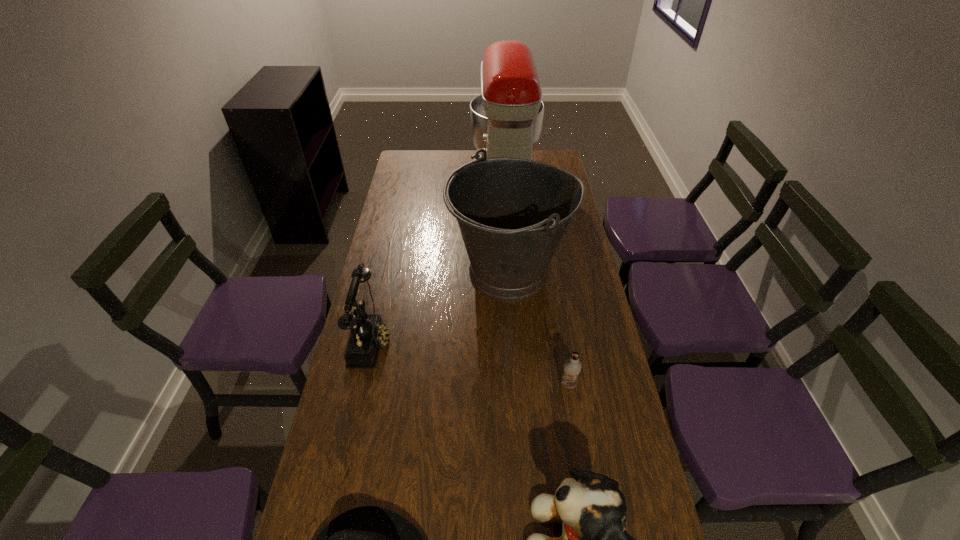
Find the location of a particular element. Image resolution: width=960 pixels, height=540 pixels. the tallest object is located at coordinates (506, 120).

Identify the location of mixer. This screenshot has height=540, width=960. (506, 120).

You are a GUI agent. You are given a task and a screenshot of the screen. Output one action in this format:
    pyautogui.click(x=<x>, y=<y>)
    Task: Click on the bucket
    
    Given the screenshot: What is the action you would take?
    pyautogui.click(x=512, y=213)

Identify the location of telephone. (368, 333).

I want to click on the second shortest object, so click(x=572, y=366).

Find the location of `chocolate milk`. chocolate milk is located at coordinates (572, 366).

Locate an element on the screen. The width and height of the screenshot is (960, 540). free space located 0.280m on the front-facing side of the mixer is located at coordinates (410, 179).

In order to click on vacant area located 0.060m on the front-facing side of the mixer in this screenshot , I will do `click(458, 179)`.

Find the location of a particular element. The image size is (960, 540). blank space located 0.150m on the front-facing side of the mixer is located at coordinates (438, 179).

The width and height of the screenshot is (960, 540). Find the location of `vacant space located on the front of the fifth shortest object`. vacant space located on the front of the fifth shortest object is located at coordinates (519, 409).